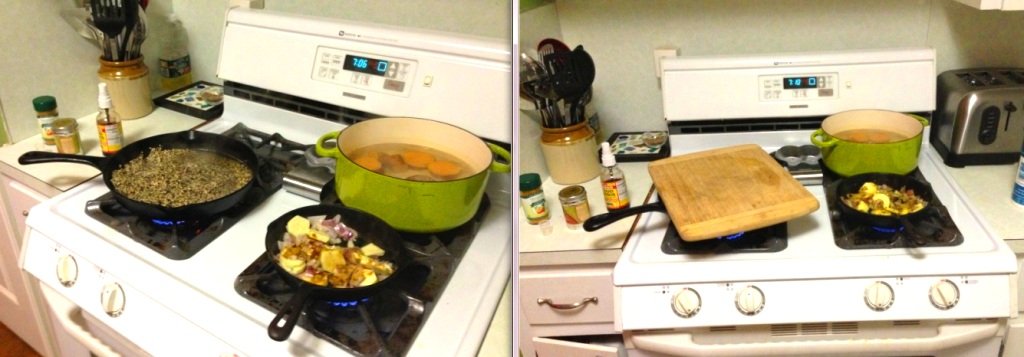
Find the location of `handle`. handle is located at coordinates (569, 305).